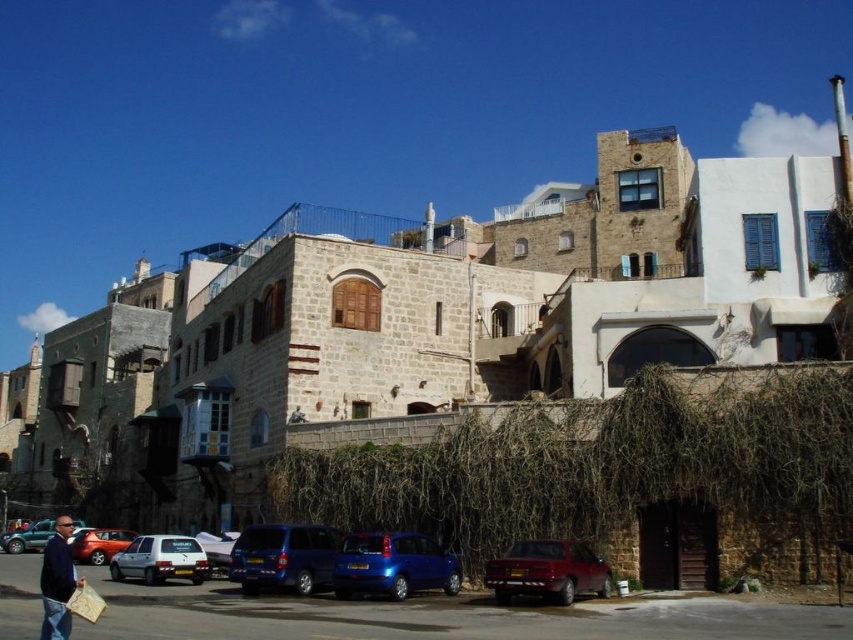
You are a delivery person who needs to park your van between the shiny blue car at center and the matte blue car at lower left. The van is 14 feet long. Is there enough space between them?

The distance between the shiny blue car at center and the matte blue car at lower left is 142.95 feet. Since the van is only 14 feet long, there is more than enough space to park between them.

You are a delivery person who needs to park a delivery van that is 2 meters wide. You see the brown straw at center and the shiny blue car at center. Which object is wider, and can you safely park your van between them without touching either?

The brown straw at center is wider than the shiny blue car at center. Since the delivery van is 2 meters wide, you need to check the available space between them. However, the description only states that the brown straw is wider, but does not provide exact measurements of the space between them. Without knowing the exact distance between the two objects, it is uncertain if the van can fit safely. Please measure the space before parking.

You are standing at the point closest to the parked cars on the street. There are two points marked in the scene, one at coordinate point [769,452] and the other at point [408,564]. Which of these points is located behind the parked cars?

Point [769,452] is behind point [408,564], so the point at [769,452] is located behind the parked cars.